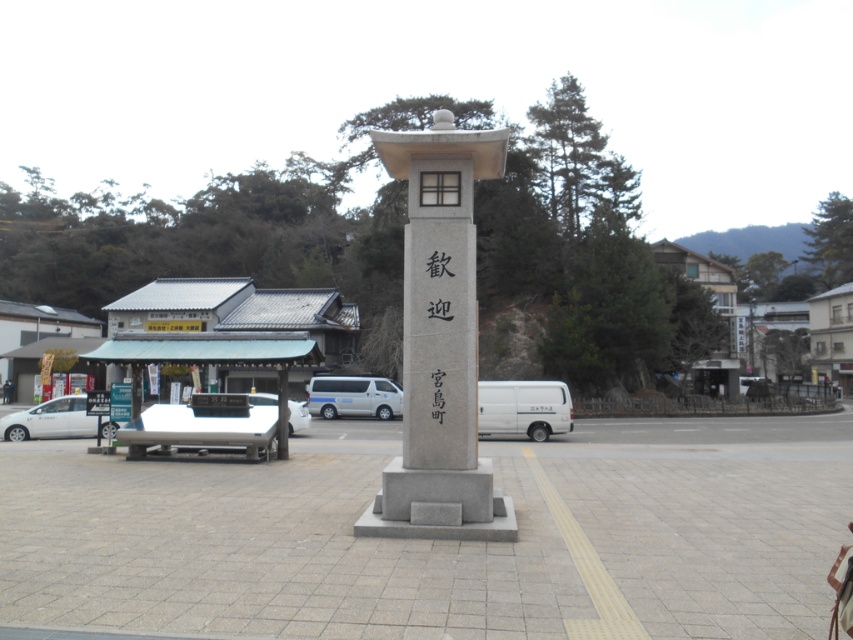
Based on the photo, you are a delivery person trying to park your white matte van at center. There is another white matte van at lower left nearby. Based on the scene, can you park your van under the other van?

The white matte van at center is already positioned under the white matte van at lower left, so you cannot park there as it is already occupied.

You are a delivery driver who needs to park your white glossy van at center in a parking spot that is exactly the width of the black stone writing at center. Will your van fit in the parking spot?

The white glossy van at center is wider than the black stone writing at center, so it will not fit in the parking spot.